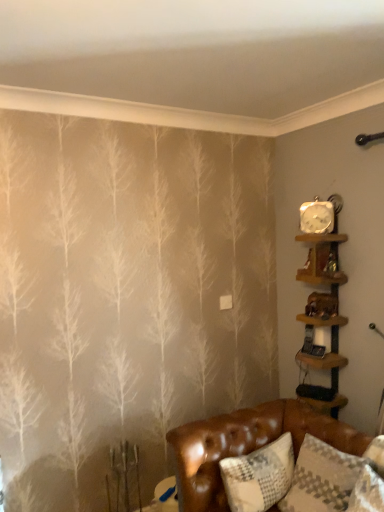
Question: Does white textured pillow at lower right come behind wooden shelf at upper right, marked as the 2th shelf in a bottom-to-top arrangement?

Choices:
 (A) yes
 (B) no

Answer: (B)

Question: From a real-world perspective, is white textured pillow at lower right over wooden shelf at upper right, marked as the 2th shelf in a bottom-to-top arrangement?

Choices:
 (A) no
 (B) yes

Answer: (A)

Question: Is white textured pillow at lower right not inside wooden shelf at upper right, marked as the 2th shelf in a bottom-to-top arrangement?

Choices:
 (A) no
 (B) yes

Answer: (B)

Question: Does white textured pillow at lower right have a smaller size compared to wooden shelf at upper right, which is counted as the 1th shelf, starting from the top?

Choices:
 (A) no
 (B) yes

Answer: (A)

Question: Can you confirm if white textured pillow at lower right is shorter than wooden shelf at upper right, which is counted as the 1th shelf, starting from the top?

Choices:
 (A) no
 (B) yes

Answer: (A)

Question: In the image, is white textured pillow at lower right positioned in front of or behind wooden shelf at upper right, which is counted as the 1th shelf, starting from the top?

Choices:
 (A) front
 (B) behind

Answer: (A)

Question: Considering the positions of white textured pillow at lower right and wooden shelf at upper right, marked as the 2th shelf in a bottom-to-top arrangement, in the image, is white textured pillow at lower right taller or shorter than wooden shelf at upper right, marked as the 2th shelf in a bottom-to-top arrangement,?

Choices:
 (A) short
 (B) tall

Answer: (B)

Question: Based on their positions, is white textured pillow at lower right located to the left or right of wooden shelf at upper right, which is counted as the 1th shelf, starting from the top?

Choices:
 (A) left
 (B) right

Answer: (A)

Question: Does point (327, 498) appear closer or farther from the camera than point (296, 236)?

Choices:
 (A) farther
 (B) closer

Answer: (B)

Question: Is point (311, 215) positioned closer to the camera than point (317, 412)?

Choices:
 (A) farther
 (B) closer

Answer: (A)

Question: Based on their positions, is metallic silver clock at upper right located to the left or right of brown leather couch at lower right?

Choices:
 (A) right
 (B) left

Answer: (A)

Question: From a real-world perspective, is metallic silver clock at upper right above or below brown leather couch at lower right?

Choices:
 (A) above
 (B) below

Answer: (A)

Question: Is metallic silver clock at upper right wider or thinner than brown leather couch at lower right?

Choices:
 (A) wide
 (B) thin

Answer: (B)

Question: Considering their positions, is brown leather couch at lower right located in front of or behind metallic silver clock at upper right?

Choices:
 (A) front
 (B) behind

Answer: (A)

Question: In terms of height, does brown leather couch at lower right look taller or shorter compared to metallic silver clock at upper right?

Choices:
 (A) tall
 (B) short

Answer: (A)